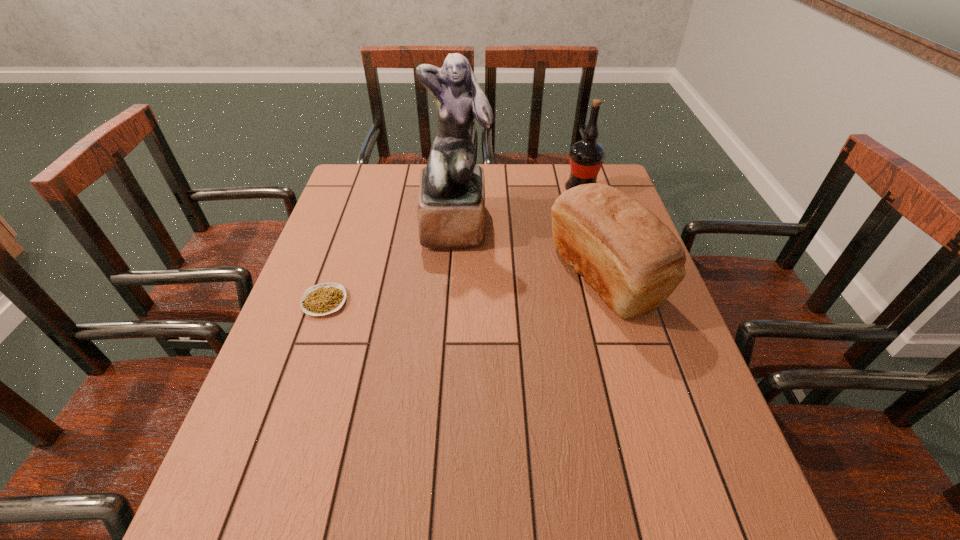
I want to click on vacant space located 0.150m on the front of the shortest object, so click(x=300, y=373).

In order to click on sculpture that is at the far edge in this screenshot , I will do `click(451, 204)`.

Where is `wine bottle present at the far edge`? The height and width of the screenshot is (540, 960). wine bottle present at the far edge is located at coordinates (586, 156).

Where is `object present at the left edge`? object present at the left edge is located at coordinates (325, 298).

The image size is (960, 540). I want to click on wine bottle that is at the right edge, so click(586, 156).

You are a GUI agent. You are given a task and a screenshot of the screen. Output one action in this format:
    pyautogui.click(x=<x>, y=<y>)
    Task: Click on the bread present at the right edge
    
    Given the screenshot: What is the action you would take?
    pyautogui.click(x=634, y=261)

Where is `object situated at the far right corner`? object situated at the far right corner is located at coordinates (586, 156).

In the image, there is a desktop. In order to click on free region at the far edge in this screenshot , I will do `click(520, 191)`.

Locate an element on the screen. vacant area at the near edge is located at coordinates (343, 501).

Locate an element on the screen. The width and height of the screenshot is (960, 540). free point at the left edge is located at coordinates (336, 227).